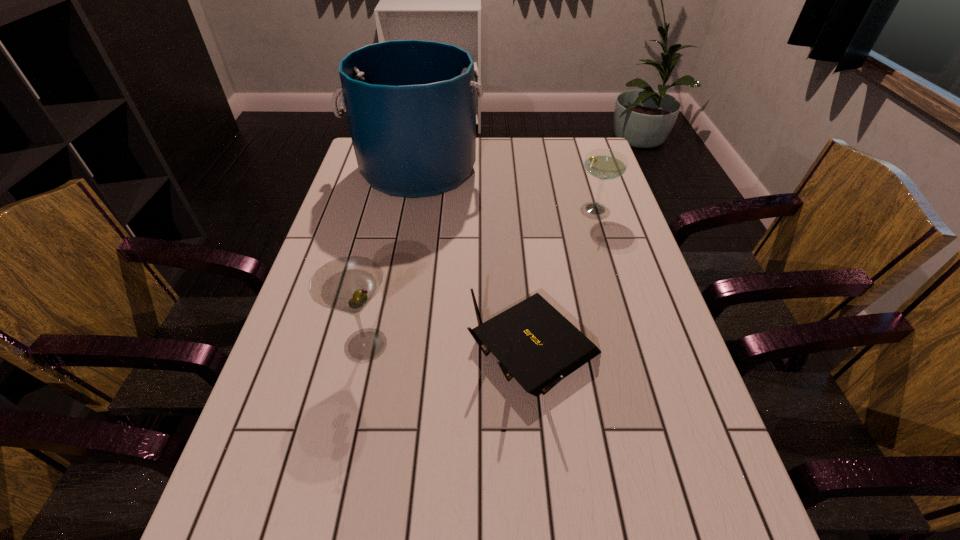
This screenshot has width=960, height=540. I want to click on free space that satisfies the following two spatial constraints: 1. on the front side of the bucket; 2. on the right side of the router, so click(x=384, y=349).

You are a GUI agent. You are given a task and a screenshot of the screen. Output one action in this format:
    pyautogui.click(x=<x>, y=<y>)
    Task: Click on the vacant position in the image that satisfies the following two spatial constraints: 1. on the front side of the bucket; 2. on the left side of the shortest object
    This screenshot has width=960, height=540.
    Given the screenshot: What is the action you would take?
    pyautogui.click(x=384, y=349)

Identify the location of vacant space that satisfies the following two spatial constraints: 1. on the back side of the bucket; 2. on the left side of the taller martini. Image resolution: width=960 pixels, height=540 pixels. (405, 170).

The width and height of the screenshot is (960, 540). I want to click on free space that satisfies the following two spatial constraints: 1. on the back side of the farther martini; 2. on the right side of the taller martini, so click(x=396, y=209).

Identify the location of vacant space that satisfies the following two spatial constraints: 1. on the back side of the third tallest object; 2. on the right side of the second tallest object. click(x=396, y=209).